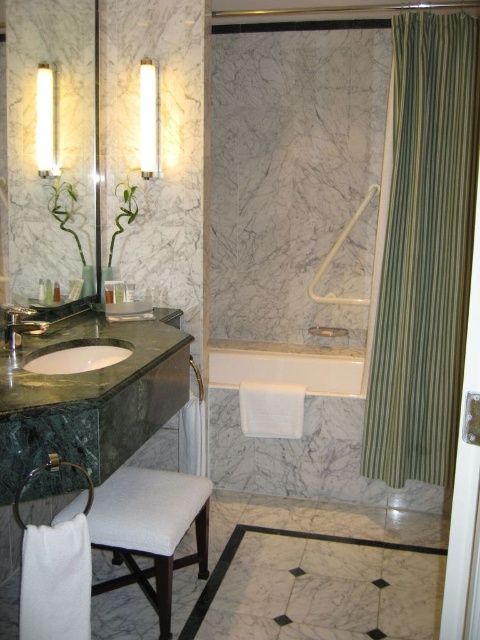
Question: Which of the following is the closest to the observer?

Choices:
 (A) white marble bathtub at center
 (B) green marble counter top at left

Answer: (B)

Question: Does white marble bathtub at center have a greater width compared to green marble sink at lower left?

Choices:
 (A) no
 (B) yes

Answer: (B)

Question: Which point appears farthest from the camera in this image?

Choices:
 (A) (46, 442)
 (B) (29, 317)
 (C) (118, 349)

Answer: (B)

Question: Which point is closer to the camera?

Choices:
 (A) green striped fabric at right
 (B) green marble counter top at left
 (C) white marble bathtub at center

Answer: (B)

Question: Where is white fabric stool at lower left located in relation to matte green marble faucet at left in the image?

Choices:
 (A) above
 (B) below

Answer: (B)

Question: Is green marble counter top at left above white marble bathtub at center?

Choices:
 (A) no
 (B) yes

Answer: (B)